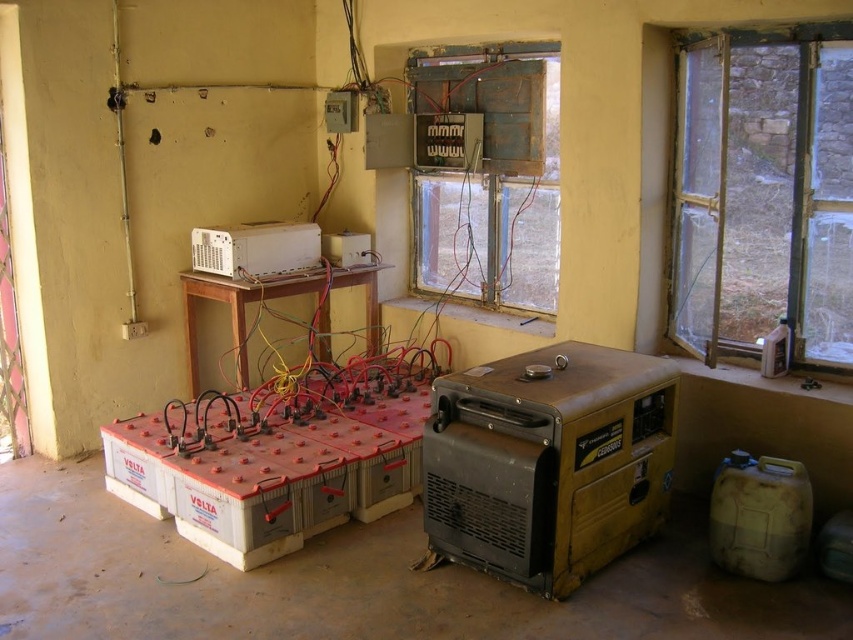
Question: Which point is farther from the camera taking this photo?

Choices:
 (A) pos(212,266)
 (B) pos(718,195)
 (C) pos(575,404)

Answer: (A)

Question: Which of the following is the closest to the observer?

Choices:
 (A) transparent glass window at right
 (B) yellow metallic generator at center

Answer: (B)

Question: Which of the following is the closest to the observer?

Choices:
 (A) transparent glass window at right
 (B) white plastic device at center
 (C) wooden frame at center

Answer: (A)

Question: From the image, what is the correct spatial relationship of wooden frame at center in relation to white plastic microwave at upper center?

Choices:
 (A) right
 (B) left

Answer: (A)

Question: Is transparent glass window at right above yellow metallic generator at center?

Choices:
 (A) yes
 (B) no

Answer: (A)

Question: In this image, where is transparent glass window at right located relative to yellow metallic generator at center?

Choices:
 (A) above
 (B) below

Answer: (A)